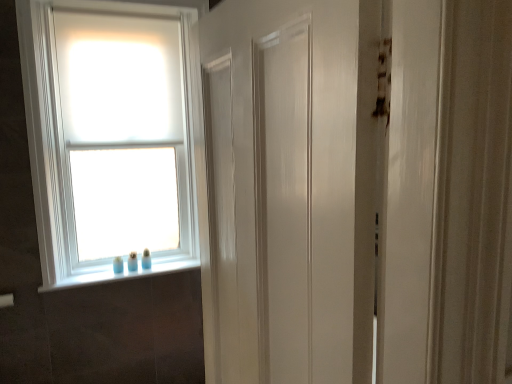
The height and width of the screenshot is (384, 512). What do you see at coordinates (109, 135) in the screenshot?
I see `white matte window at upper left` at bounding box center [109, 135].

This screenshot has width=512, height=384. I want to click on white matte window at upper left, so click(x=109, y=135).

What is the approximate height of white matte window at upper left?

The height of white matte window at upper left is 1.66 meters.

The image size is (512, 384). What do you see at coordinates (123, 274) in the screenshot? I see `white glossy window sill at lower left` at bounding box center [123, 274].

Locate an element on the screen. The width and height of the screenshot is (512, 384). white glossy window sill at lower left is located at coordinates (123, 274).

You are a GUI agent. You are given a task and a screenshot of the screen. Output one action in this format:
    pyautogui.click(x=<x>, y=<y>)
    Task: Click on the white matte window at upper left
    This screenshot has height=384, width=512.
    Given the screenshot: What is the action you would take?
    pyautogui.click(x=109, y=135)

Which is more to the right, white matte window at upper left or white glossy window sill at lower left?

white glossy window sill at lower left.

Is white matte window at upper left positioned behind white glossy window sill at lower left?

No, the depth of white matte window at upper left is less than that of white glossy window sill at lower left.

Considering the points (126, 205) and (118, 280), which point is behind, point (126, 205) or point (118, 280)?

The point (126, 205) is farther from the camera.

From the image's perspective, which one is positioned lower, white matte window at upper left or white glossy window sill at lower left?

white glossy window sill at lower left is shown below in the image.

From a real-world perspective, who is located lower, white matte window at upper left or white glossy window sill at lower left?

In real-world perspective, white glossy window sill at lower left is lower.

Does white matte window at upper left have a greater width compared to white glossy window sill at lower left?

Correct, the width of white matte window at upper left exceeds that of white glossy window sill at lower left.

Is white matte window at upper left shorter than white glossy window sill at lower left?

In fact, white matte window at upper left may be taller than white glossy window sill at lower left.

Considering the sizes of objects white matte window at upper left and white glossy window sill at lower left in the image provided, who is bigger, white matte window at upper left or white glossy window sill at lower left?

With larger size is white matte window at upper left.

Is white glossy window sill at lower left surrounded by white matte window at upper left?

No, white glossy window sill at lower left is not a part of white matte window at upper left.

Does white matte window at upper left touch white glossy window sill at lower left?

No, white matte window at upper left is not touching white glossy window sill at lower left.

Could you tell me if white matte window at upper left is turned towards white glossy window sill at lower left?

No, white matte window at upper left is not facing towards white glossy window sill at lower left.

How different are the orientations of white matte window at upper left and white glossy window sill at lower left in degrees?

0.226 degrees.

Locate an element on the screen. The width and height of the screenshot is (512, 384). window sill on the right of white matte window at upper left is located at coordinates pyautogui.click(x=123, y=274).

Which object is positioned more to the right, white glossy window sill at lower left or white matte window at upper left?

white glossy window sill at lower left.

Which object is further away from the camera taking this photo, white glossy window sill at lower left or white matte window at upper left?

white glossy window sill at lower left is behind.

Is point (125, 262) positioned in front of point (143, 218)?

Yes, point (125, 262) is in front of point (143, 218).

From the image's perspective, which one is positioned lower, white glossy window sill at lower left or white matte window at upper left?

white glossy window sill at lower left, from the image's perspective.

From a real-world perspective, is white glossy window sill at lower left physically located above or below white matte window at upper left?

Clearly, from a real-world perspective, white glossy window sill at lower left is below white matte window at upper left.

Is white glossy window sill at lower left wider or thinner than white matte window at upper left?

white glossy window sill at lower left is thinner than white matte window at upper left.

Considering the relative sizes of white glossy window sill at lower left and white matte window at upper left in the image provided, is white glossy window sill at lower left taller than white matte window at upper left?

Incorrect, the height of white glossy window sill at lower left is not larger of that of white matte window at upper left.

Considering the sizes of objects white glossy window sill at lower left and white matte window at upper left in the image provided, who is smaller, white glossy window sill at lower left or white matte window at upper left?

With smaller size is white glossy window sill at lower left.

Is white matte window at upper left a part of white glossy window sill at lower left?

Actually, white matte window at upper left is outside white glossy window sill at lower left.

Are white glossy window sill at lower left and white matte window at upper left far apart?

No.

Is white glossy window sill at lower left positioned with its back to white matte window at upper left?

No, white glossy window sill at lower left's orientation is not away from white matte window at upper left.

You are a GUI agent. You are given a task and a screenshot of the screen. Output one action in this format:
    pyautogui.click(x=<x>, y=<y>)
    Task: Click on the window sill below the white matte window at upper left (from a real-world perspective)
    The width and height of the screenshot is (512, 384).
    Given the screenshot: What is the action you would take?
    pyautogui.click(x=123, y=274)

Find the location of a particular element. Image resolution: width=512 pixels, height=384 pixels. window sill located underneath the white matte window at upper left (from a real-world perspective) is located at coordinates (123, 274).

You are a GUI agent. You are given a task and a screenshot of the screen. Output one action in this format:
    pyautogui.click(x=<x>, y=<y>)
    Task: Click on the window sill that appears behind the white matte window at upper left
    This screenshot has width=512, height=384.
    Given the screenshot: What is the action you would take?
    pyautogui.click(x=123, y=274)